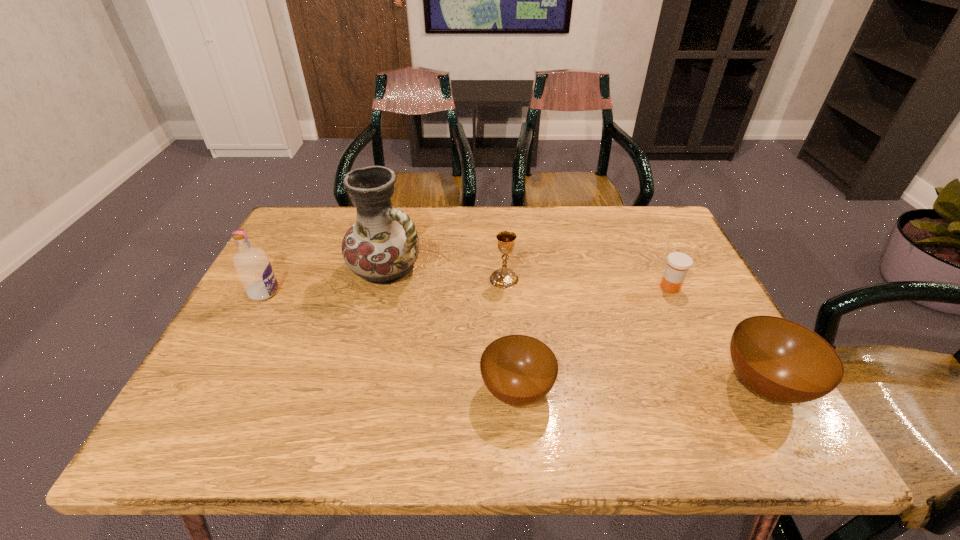
I want to click on unoccupied area between the second object from left to right and the vodka, so click(325, 281).

Where is `free space between the tallest object and the taller bowl`? free space between the tallest object and the taller bowl is located at coordinates [576, 327].

The image size is (960, 540). I want to click on vacant space that's between the tallest object and the taller bowl, so tap(576, 327).

Find the location of `free spot between the chalice and the right bowl`. free spot between the chalice and the right bowl is located at coordinates (635, 332).

You are a GUI agent. You are given a task and a screenshot of the screen. Output one action in this format:
    pyautogui.click(x=<x>, y=<y>)
    Task: Click on the free space that is in between the chalice and the medicine
    
    Given the screenshot: What is the action you would take?
    pyautogui.click(x=588, y=283)

Locate an element on the screen. vacant area that lies between the second tallest object and the medicine is located at coordinates (467, 290).

Identify the location of free area in between the right bowl and the medicine. (717, 336).

Where is `object that is the third closest to the left bowl`? The image size is (960, 540). object that is the third closest to the left bowl is located at coordinates (781, 360).

Select which object is the fifth closest to the shorter bowl. Please provide its 2D coordinates. Your answer should be formatted as a tuple, i.e. [(x, y)], where the tuple contains the x and y coordinates of a point satisfying the conditions above.

[(253, 267)]

Where is `vacant space that satisfies the following two spatial constraints: 1. on the label of the medicine; 2. on the back side of the taller bowl`? Image resolution: width=960 pixels, height=540 pixels. vacant space that satisfies the following two spatial constraints: 1. on the label of the medicine; 2. on the back side of the taller bowl is located at coordinates (716, 384).